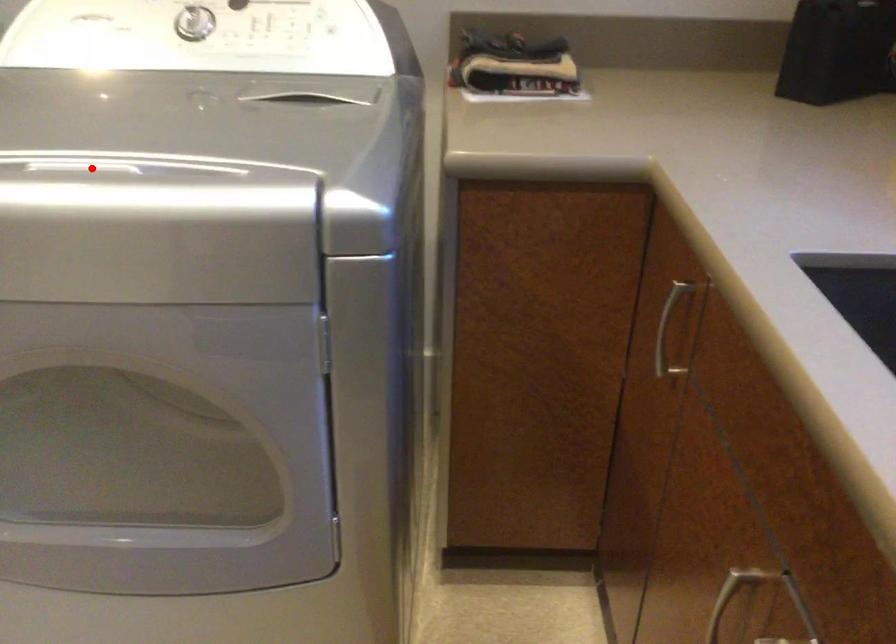
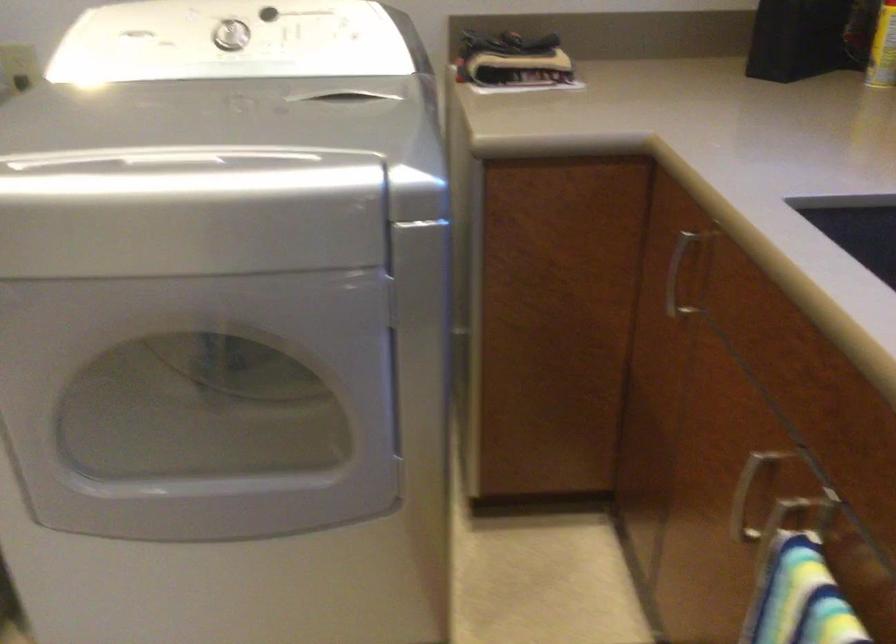
The point at the highlighted location is marked in the first image. Where is the corresponding point in the second image?

(178, 160)